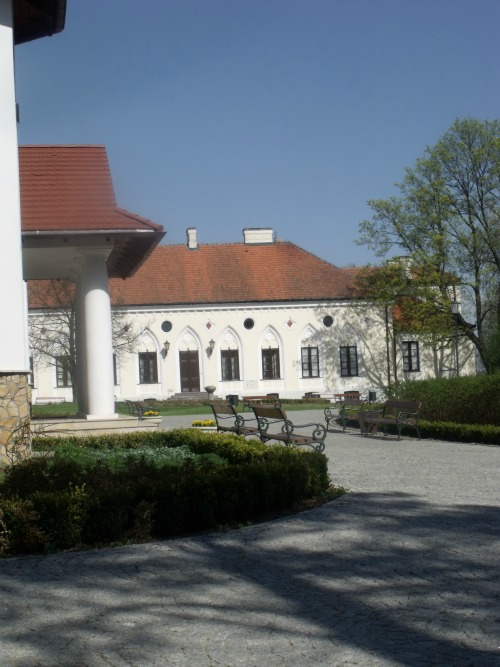
Where is `support pillar`? This screenshot has width=500, height=667. support pillar is located at coordinates (99, 352), (79, 366).